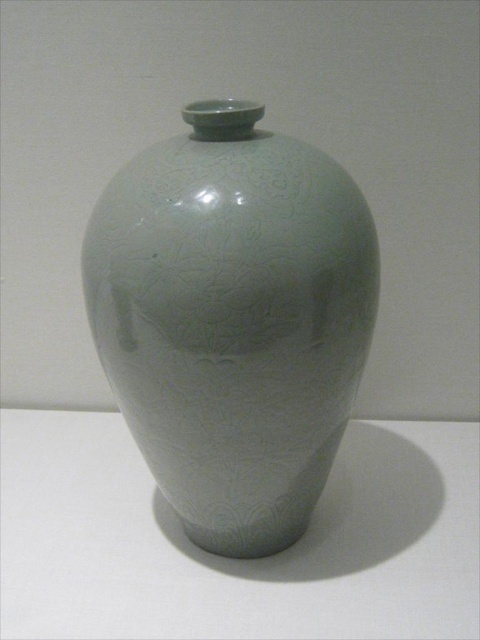
Question: Which point is farther from the camera taking this photo?

Choices:
 (A) (171, 170)
 (B) (441, 445)

Answer: (B)

Question: Can you confirm if matte porcelain vase at center is bigger than white glossy table at center?

Choices:
 (A) yes
 (B) no

Answer: (B)

Question: Can you confirm if matte porcelain vase at center is wider than white glossy table at center?

Choices:
 (A) no
 (B) yes

Answer: (A)

Question: Does matte porcelain vase at center have a larger size compared to white glossy table at center?

Choices:
 (A) no
 (B) yes

Answer: (A)